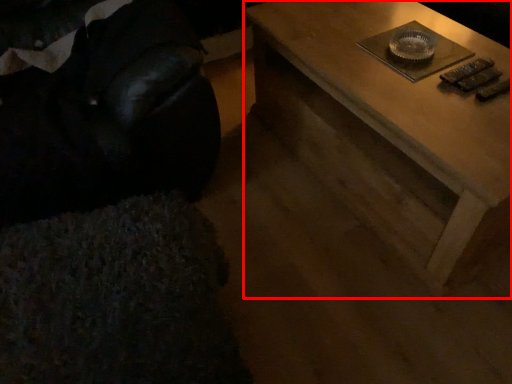
Question: In this image, where is table (annotated by the red box) located relative to bean bag chair?

Choices:
 (A) left
 (B) right

Answer: (B)